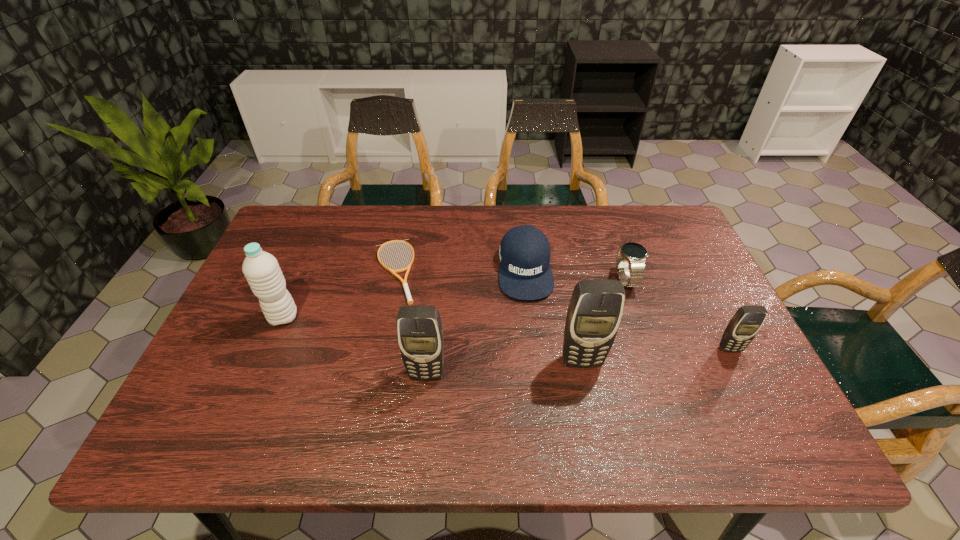
I want to click on the leftmost cellular telephone, so click(420, 336).

Where is `the second shortest cellular telephone`? the second shortest cellular telephone is located at coordinates (420, 336).

Where is `the second cellular telephone from right to left`? This screenshot has height=540, width=960. the second cellular telephone from right to left is located at coordinates [594, 314].

You are a GUI agent. You are given a task and a screenshot of the screen. Output one action in this format:
    pyautogui.click(x=<x>, y=<y>)
    Task: Click on the fourth shortest object
    
    Given the screenshot: What is the action you would take?
    pyautogui.click(x=747, y=321)

At what (x,y) coordinates should I click in order to perform the action: click on the rightmost object. Please return your answer as a coordinate pair (x, y). This screenshot has width=960, height=540. Looking at the image, I should click on (x=747, y=321).

Find the location of `water bottle`. water bottle is located at coordinates (261, 269).

You are a GUI agent. You are given a task and a screenshot of the screen. Output one action in this format:
    pyautogui.click(x=<x>, y=<y>)
    Task: Click on the leftmost object
    
    Given the screenshot: What is the action you would take?
    pyautogui.click(x=261, y=269)

In order to click on the shortest object in this screenshot , I will do `click(404, 282)`.

Identify the location of the second object from left to right. click(404, 282).

Locate an element on the screen. Image resolution: width=960 pixels, height=540 pixels. the sixth object from left to right is located at coordinates (634, 253).